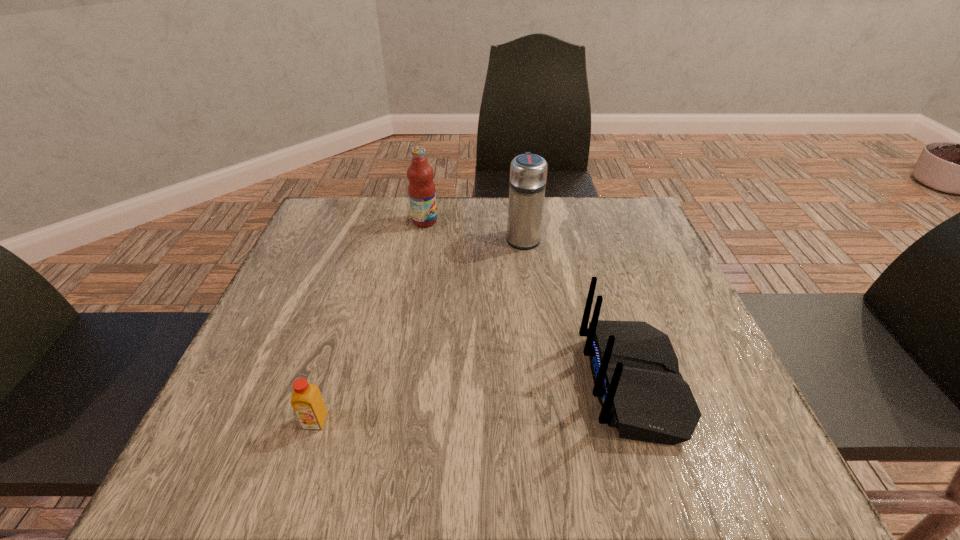
Image resolution: width=960 pixels, height=540 pixels. What are the coordinates of `vacant point located on the back of the router` in the screenshot? It's located at (541, 383).

The image size is (960, 540). Identify the location of vacant area located 0.380m on the back of the router. (374, 383).

Find the location of a particular element. The width and height of the screenshot is (960, 540). free space located 0.150m on the back of the router is located at coordinates (502, 383).

In order to click on vacant space situated on the front and back of the leftmost object in this screenshot , I will do `click(298, 480)`.

The width and height of the screenshot is (960, 540). What are the coordinates of `thermos bottle located at the far edge` in the screenshot? It's located at (528, 172).

Where is `fruit juice that is at the far edge`? fruit juice that is at the far edge is located at coordinates (421, 189).

Image resolution: width=960 pixels, height=540 pixels. What are the coordinates of `router located in the near edge section of the desktop` in the screenshot? It's located at (635, 370).

Image resolution: width=960 pixels, height=540 pixels. I want to click on orange juice that is at the near edge, so click(x=307, y=402).

At what (x,y) coordinates should I click in order to perform the action: click on object present at the left edge. Please return your answer as a coordinate pair (x, y). Looking at the image, I should click on (307, 402).

The image size is (960, 540). I want to click on object positioned at the right edge, so pyautogui.click(x=635, y=370).